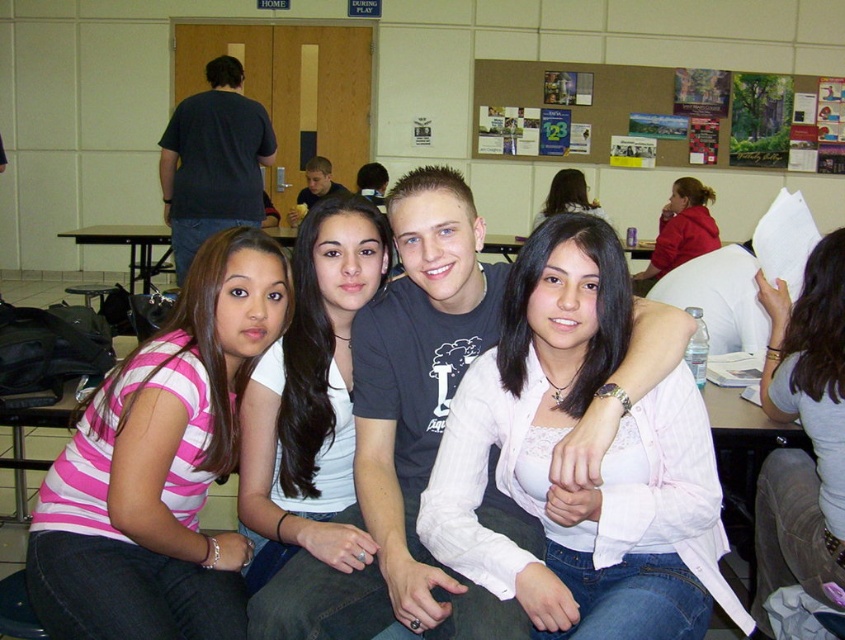
You are a photographer trying to capture a clear shot of the matte red hoodie at upper right without the pink striped shirt at lower left blocking it. What should you do?

Move the camera position to the right side so that the pink striped shirt at lower left is no longer in front of the matte red hoodie at upper right.

You are standing at the point labeled as point (529, 324) in the image. You want to walk to the door marked DURING PLAY. Is the door marked DURING PLAY located to your left or right side?

The door marked DURING PLAY is located to the left side of the point (529, 324).